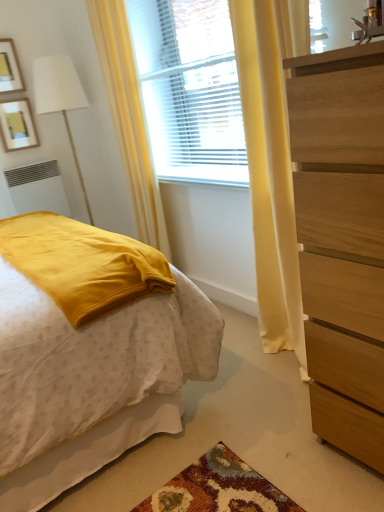
Question: From a real-world perspective, is wooden dresser at right on top of white matte radiator at lower left?

Choices:
 (A) no
 (B) yes

Answer: (A)

Question: Is wooden dresser at right looking in the opposite direction of white matte radiator at lower left?

Choices:
 (A) no
 (B) yes

Answer: (A)

Question: Does wooden dresser at right have a larger size compared to white matte radiator at lower left?

Choices:
 (A) no
 (B) yes

Answer: (B)

Question: Is there a large distance between wooden dresser at right and white matte radiator at lower left?

Choices:
 (A) yes
 (B) no

Answer: (A)

Question: From the image's perspective, is wooden dresser at right under white matte radiator at lower left?

Choices:
 (A) yes
 (B) no

Answer: (A)

Question: From the image's perspective, relative to matte yellow blanket at left, is wooden picture frame at upper left, placed as the first picture frame when sorted from bottom to top, above or below?

Choices:
 (A) below
 (B) above

Answer: (B)

Question: Is wooden picture frame at upper left, placed as the first picture frame when sorted from bottom to top, wider or thinner than matte yellow blanket at left?

Choices:
 (A) wide
 (B) thin

Answer: (B)

Question: Considering the positions of point (28, 112) and point (72, 483), is point (28, 112) closer or farther from the camera than point (72, 483)?

Choices:
 (A) farther
 (B) closer

Answer: (A)

Question: Is wooden picture frame at upper left, placed as the first picture frame when sorted from bottom to top, inside or outside of matte yellow blanket at left?

Choices:
 (A) inside
 (B) outside

Answer: (B)

Question: In terms of width, does matte yellow blanket at left look wider or thinner when compared to white matte radiator at lower left?

Choices:
 (A) thin
 (B) wide

Answer: (B)

Question: From a real-world perspective, relative to white matte radiator at lower left, is matte yellow blanket at left vertically above or below?

Choices:
 (A) below
 (B) above

Answer: (A)

Question: Considering their positions, is matte yellow blanket at left located in front of or behind white matte radiator at lower left?

Choices:
 (A) behind
 (B) front

Answer: (B)

Question: Is point (9, 353) positioned closer to the camera than point (56, 170)?

Choices:
 (A) farther
 (B) closer

Answer: (B)

Question: Looking at their shapes, would you say yellow fabric curtain at left is wider or thinner than white matte radiator at lower left?

Choices:
 (A) wide
 (B) thin

Answer: (A)

Question: Is yellow fabric curtain at left spatially inside white matte radiator at lower left, or outside of it?

Choices:
 (A) inside
 (B) outside

Answer: (B)